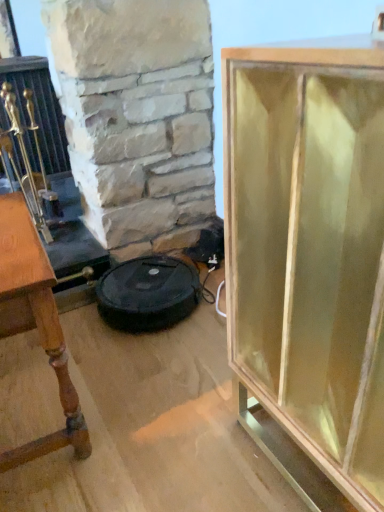
You are a GUI agent. You are given a task and a screenshot of the screen. Output one action in this format:
    pyautogui.click(x=<x>, y=<y>)
    Task: Click on the free spot to the right of wooden table at left
    The image size is (384, 512).
    Given the screenshot: What is the action you would take?
    pyautogui.click(x=151, y=398)